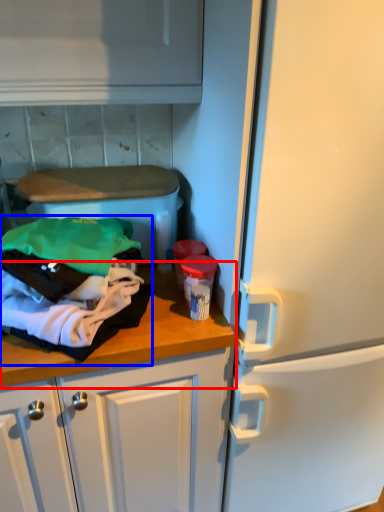
Question: Which point is closer to the camera, countertop (highlighted by a red box) or clothing (highlighted by a blue box)?

Choices:
 (A) countertop
 (B) clothing

Answer: (B)